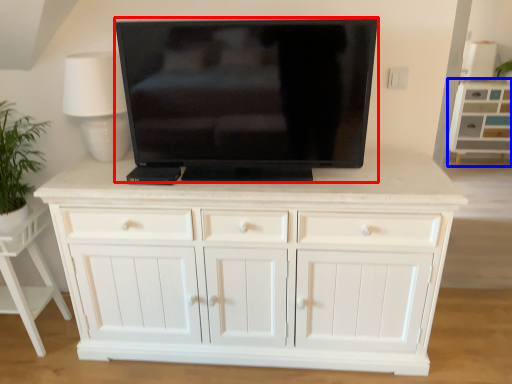
Question: Which object appears farthest to the camera in this image, television (highlighted by a red box) or cabinetry (highlighted by a blue box)?

Choices:
 (A) television
 (B) cabinetry

Answer: (B)